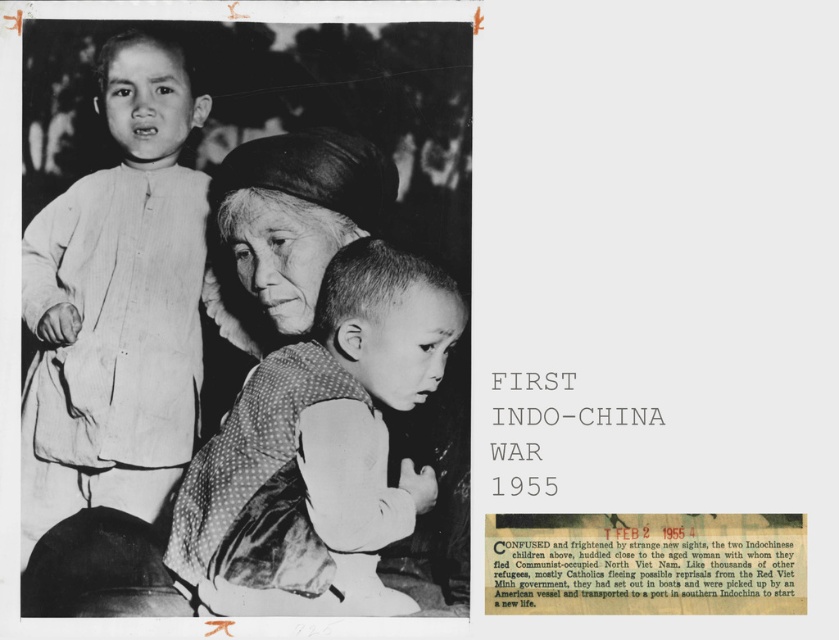
Question: Can you confirm if light-colored fabric child at upper left is smaller than polka dot fabric baby at center?

Choices:
 (A) no
 (B) yes

Answer: (A)

Question: Can you confirm if light-colored fabric child at upper left is bigger than polka dot fabric baby at center?

Choices:
 (A) no
 (B) yes

Answer: (B)

Question: Which of the following is the farthest from the observer?

Choices:
 (A) light-colored fabric child at upper left
 (B) polka dot fabric baby at center

Answer: (A)

Question: Can you confirm if light-colored fabric child at upper left is smaller than polka dot fabric baby at center?

Choices:
 (A) no
 (B) yes

Answer: (A)

Question: Which object is farther from the camera taking this photo?

Choices:
 (A) light-colored fabric child at upper left
 (B) polka dot fabric baby at center

Answer: (A)